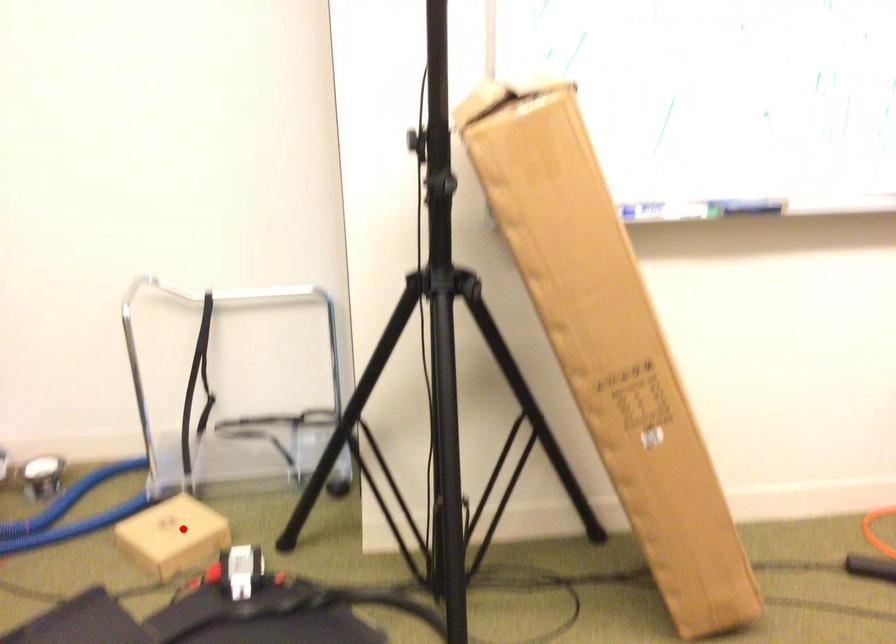
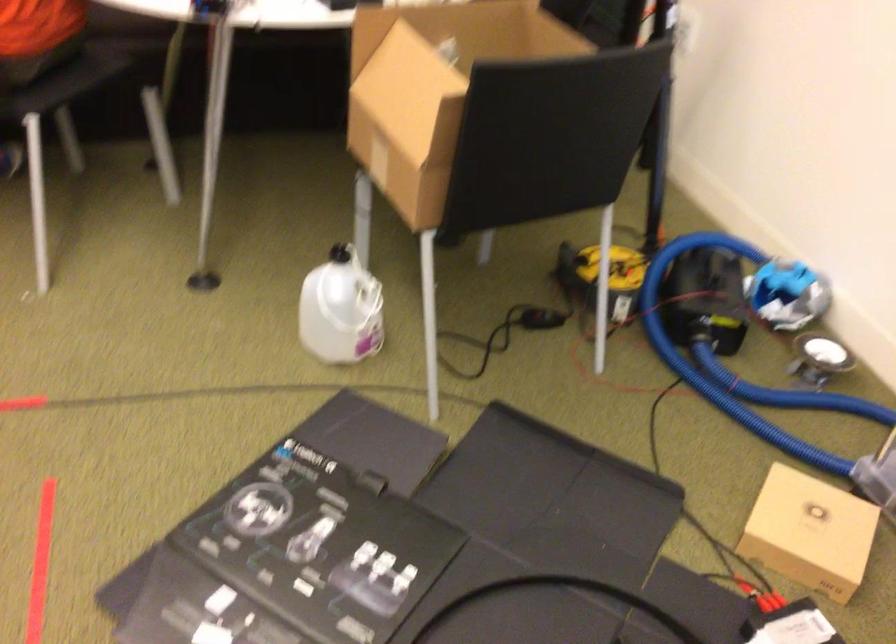
Locate, in the second image, the point that corresponds to the highlighted location in the first image.

(810, 532)